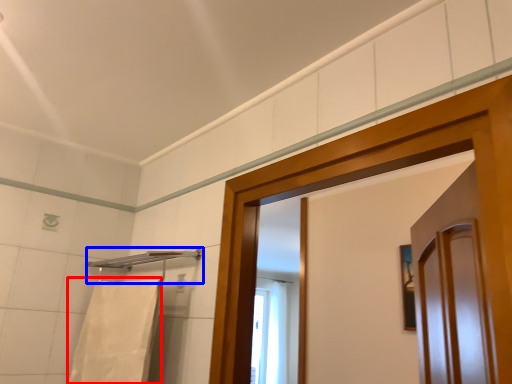
Question: Which object is closer to the camera taking this photo, bath towel (highlighted by a red box) or towel bar (highlighted by a blue box)?

Choices:
 (A) bath towel
 (B) towel bar

Answer: (A)